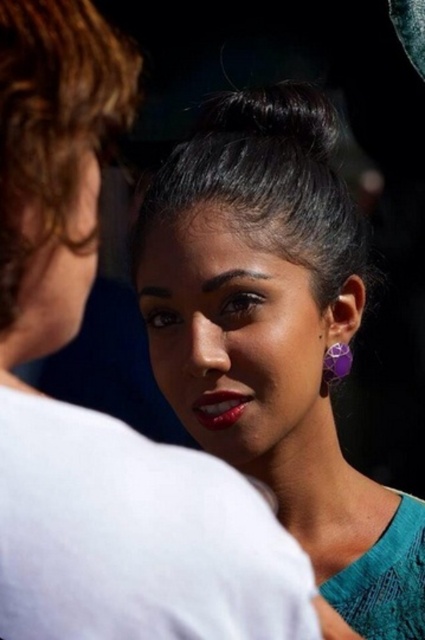
Who is positioned more to the right, teal fabric dress at center or black shiny hair at center?

teal fabric dress at center is more to the right.

Find the location of a particular element. The image size is (425, 640). teal fabric dress at center is located at coordinates (275, 336).

The image size is (425, 640). What do you see at coordinates (275, 336) in the screenshot?
I see `teal fabric dress at center` at bounding box center [275, 336].

From the picture: Is teal fabric dress at center below shiny red lipstick at lower center?

Incorrect, teal fabric dress at center is not positioned below shiny red lipstick at lower center.

Does point (302, 84) come in front of point (217, 401)?

No, (302, 84) is behind (217, 401).

Where is `teal fabric dress at center`? Image resolution: width=425 pixels, height=640 pixels. teal fabric dress at center is located at coordinates (275, 336).

Can you confirm if curly brown hair at left is shorter than purple glass earring at lower right?

In fact, curly brown hair at left may be taller than purple glass earring at lower right.

Who is taller, curly brown hair at left or purple glass earring at lower right?

curly brown hair at left is taller.

Between point (110, 125) and point (329, 371), which one is positioned in front?

Point (110, 125) is more forward.

Locate an element on the screen. The height and width of the screenshot is (640, 425). curly brown hair at left is located at coordinates (53, 124).